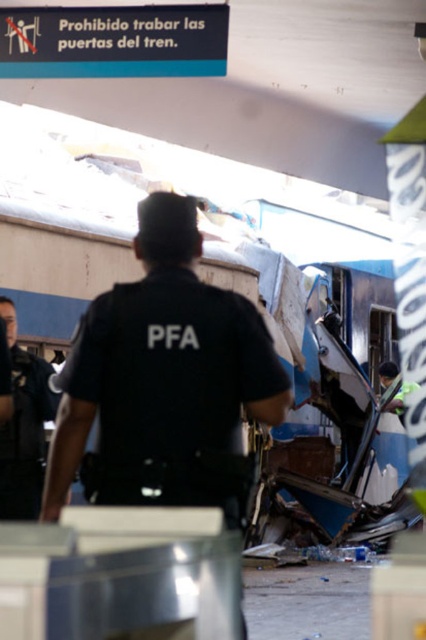
Is black uniform at center wider than dark blue uniform at left?

Indeed, black uniform at center has a greater width compared to dark blue uniform at left.

This screenshot has height=640, width=426. I want to click on black uniform at center, so click(161, 369).